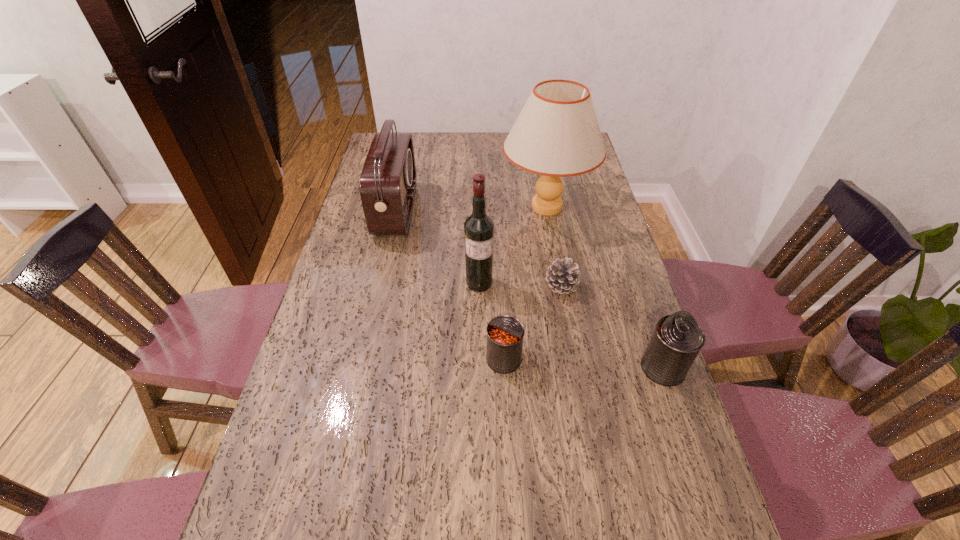
This screenshot has width=960, height=540. Identify the location of vacant region located on the front of the taller can. (719, 531).

I want to click on blank space located 0.160m on the front of the pinecone, so point(572,345).

This screenshot has width=960, height=540. I want to click on vacant area located on the front panel of the leftmost object, so click(x=442, y=211).

Where is `vacant region located 0.120m on the back of the lampshade`? vacant region located 0.120m on the back of the lampshade is located at coordinates (540, 165).

Where is `free space located 0.360m on the front and back of the wine bottle`? The width and height of the screenshot is (960, 540). free space located 0.360m on the front and back of the wine bottle is located at coordinates (479, 407).

Where is `object located in the left edge section of the desktop`? The width and height of the screenshot is (960, 540). object located in the left edge section of the desktop is located at coordinates (388, 180).

Locate an element on the screen. can that is at the right edge is located at coordinates (677, 339).

This screenshot has width=960, height=540. Identify the location of pinecone that is at the right edge. (562, 276).

Locate an element on the screen. The image size is (960, 540). lampshade at the right edge is located at coordinates (557, 134).

Image resolution: width=960 pixels, height=540 pixels. In the image, there is a desktop. Find the location of `vacant space at the far edge`. vacant space at the far edge is located at coordinates (436, 144).